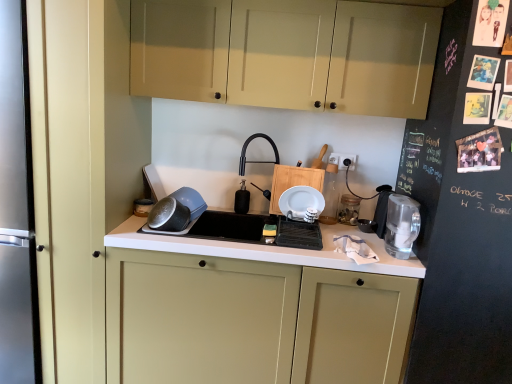
The width and height of the screenshot is (512, 384). Identify the location of blank space to the left of black matte soap dispenser at center, which is the 3th appliance from right to left. [x=219, y=209].